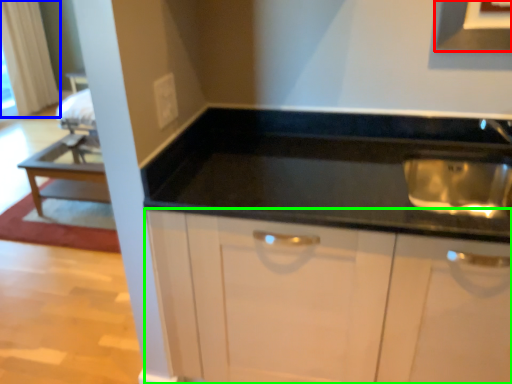
Question: Which object is the closest to the exhaust hood (highlighted by a red box)? Choose among these: curtain (highlighted by a blue box) or cabinetry (highlighted by a green box).

Choices:
 (A) curtain
 (B) cabinetry

Answer: (B)